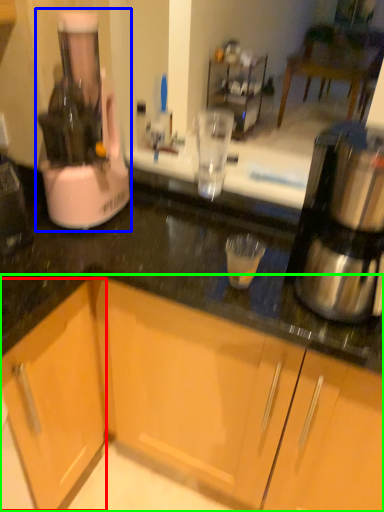
Question: Which object is positioned farthest from cabinetry (highlighted by a red box)? Select from home appliance (highlighted by a blue box) and cabinetry (highlighted by a green box).

Choices:
 (A) home appliance
 (B) cabinetry

Answer: (A)